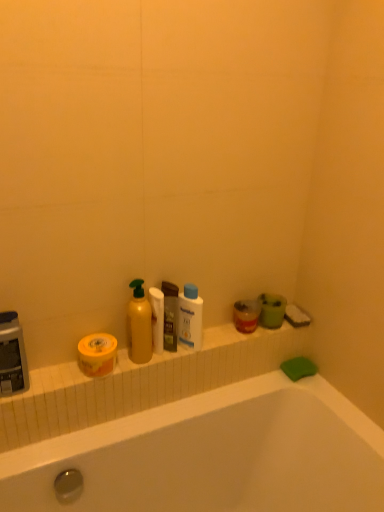
Question: Does translucent plastic mouthwash at center, marked as the second mouthwash in a left-to-right arrangement, have a larger size compared to white matte toilet paper at center?

Choices:
 (A) no
 (B) yes

Answer: (B)

Question: Is translucent plastic mouthwash at center, which is the 1th mouthwash in right-to-left order, next to white matte toilet paper at center and touching it?

Choices:
 (A) no
 (B) yes

Answer: (B)

Question: Is translucent plastic mouthwash at center, which is the 1th mouthwash in right-to-left order, facing towards white matte toilet paper at center?

Choices:
 (A) yes
 (B) no

Answer: (B)

Question: Can you confirm if translucent plastic mouthwash at center, marked as the second mouthwash in a left-to-right arrangement, is wider than white matte toilet paper at center?

Choices:
 (A) yes
 (B) no

Answer: (A)

Question: From a real-world perspective, is translucent plastic mouthwash at center, which is the 1th mouthwash in right-to-left order, physically above white matte toilet paper at center?

Choices:
 (A) yes
 (B) no

Answer: (B)

Question: From the image's perspective, is white matte toilet paper at center located above or below translucent plastic mouthwash at center, which is the 1th mouthwash in right-to-left order?

Choices:
 (A) below
 (B) above

Answer: (A)

Question: Would you say white matte toilet paper at center is to the left or to the right of translucent plastic mouthwash at center, which is the 1th mouthwash in right-to-left order, in the picture?

Choices:
 (A) left
 (B) right

Answer: (A)

Question: From a real-world perspective, relative to translucent plastic mouthwash at center, marked as the second mouthwash in a left-to-right arrangement, is white matte toilet paper at center vertically above or below?

Choices:
 (A) below
 (B) above

Answer: (B)

Question: Considering their positions, is white matte toilet paper at center located in front of or behind translucent plastic mouthwash at center, marked as the second mouthwash in a left-to-right arrangement?

Choices:
 (A) front
 (B) behind

Answer: (A)

Question: From a real-world perspective, is white matte toilet paper at center above or below yellow matte jar at left, which is the 1th mouthwash from left to right?

Choices:
 (A) below
 (B) above

Answer: (B)

Question: In terms of size, does white matte toilet paper at center appear bigger or smaller than yellow matte jar at left, which ranks as the second mouthwash in right-to-left order?

Choices:
 (A) small
 (B) big

Answer: (A)

Question: Is white matte toilet paper at center wider or thinner than yellow matte jar at left, which is the 1th mouthwash from left to right?

Choices:
 (A) thin
 (B) wide

Answer: (A)

Question: Does point (155, 290) appear closer or farther from the camera than point (89, 373)?

Choices:
 (A) closer
 (B) farther

Answer: (B)

Question: Relative to white matte toilet paper at center, is yellow matte jar at left, which ranks as the second mouthwash in right-to-left order, in front or behind?

Choices:
 (A) front
 (B) behind

Answer: (A)

Question: In terms of height, does yellow matte jar at left, which ranks as the second mouthwash in right-to-left order, look taller or shorter compared to white matte toilet paper at center?

Choices:
 (A) short
 (B) tall

Answer: (A)